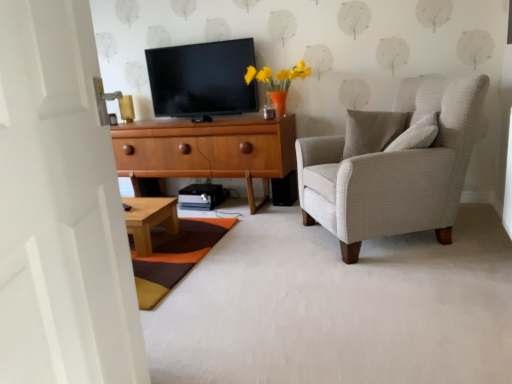
The height and width of the screenshot is (384, 512). What are the coordinates of `white wooden door at left` in the screenshot? It's located at (60, 209).

Where is `multicolored woven mat at lower center`? This screenshot has height=384, width=512. multicolored woven mat at lower center is located at coordinates (174, 256).

Identify the location of white carpet at center. The image size is (512, 384). (338, 306).

Is light gray fabric armchair at right with white carpet at center?

There is a gap between light gray fabric armchair at right and white carpet at center.

Looking at this image, which is less distant, (300, 143) or (440, 293)?

Point (440, 293)

From the image's perspective, relative to white carpet at center, is light gray fabric armchair at right above or below?

light gray fabric armchair at right is above white carpet at center.

Measure the distance from light gray fabric armchair at right to white carpet at center.

The distance of light gray fabric armchair at right from white carpet at center is 19.20 inches.

In the scene shown: Can you confirm if wooden cabinet at center is shorter than white carpet at center?

No.

Which is in front, wooden cabinet at center or white carpet at center?

white carpet at center is in front.

Is point (159, 146) closer or farther from the camera than point (421, 281)?

Point (159, 146) appears to be farther away from the viewer than point (421, 281).

From the image's perspective, which object appears higher, wooden cabinet at center or white carpet at center?

From the image's view, wooden cabinet at center is above.

Can you confirm if light gray fabric armchair at right is thinner than white wooden door at left?

In fact, light gray fabric armchair at right might be wider than white wooden door at left.

Based on the photo, from a real-world perspective, is light gray fabric armchair at right beneath white wooden door at left?

Yes, from a real-world perspective, light gray fabric armchair at right is below white wooden door at left.

Where is `door in front of the light gray fabric armchair at right`? The image size is (512, 384). door in front of the light gray fabric armchair at right is located at coordinates (60, 209).

From the image's perspective, would you say black glossy tv at upper center is positioned over multicolored woven mat at lower center?

Yes, from the image's perspective, black glossy tv at upper center is on top of multicolored woven mat at lower center.

Choose the correct answer: Is black glossy tv at upper center inside multicolored woven mat at lower center or outside it?

black glossy tv at upper center is located beyond the bounds of multicolored woven mat at lower center.

Which is more to the right, black glossy tv at upper center or multicolored woven mat at lower center?

Positioned to the right is black glossy tv at upper center.

Between point (179, 82) and point (197, 240), which one is positioned in front?

Point (197, 240)

Is wooden cabinet at center positioned with its back to light gray fabric armchair at right?

wooden cabinet at center does not have its back to light gray fabric armchair at right.

From a real-world perspective, is wooden cabinet at center under light gray fabric armchair at right?

Yes, from a real-world perspective, wooden cabinet at center is under light gray fabric armchair at right.

Is there a large distance between wooden cabinet at center and light gray fabric armchair at right?

No, there isn't a large distance between wooden cabinet at center and light gray fabric armchair at right.

Is wooden cabinet at center wider or thinner than light gray fabric armchair at right?

In the image, wooden cabinet at center appears to be more narrow than light gray fabric armchair at right.

From a real-world perspective, is black glossy tv at upper center located higher than light gray fabric armchair at right?

Indeed, from a real-world perspective, black glossy tv at upper center stands above light gray fabric armchair at right.

Is black glossy tv at upper center oriented towards light gray fabric armchair at right?

No, black glossy tv at upper center is not facing towards light gray fabric armchair at right.

Considering the relative sizes of black glossy tv at upper center and light gray fabric armchair at right in the image provided, is black glossy tv at upper center thinner than light gray fabric armchair at right?

Correct, the width of black glossy tv at upper center is less than that of light gray fabric armchair at right.

Locate an element on the screen. The height and width of the screenshot is (384, 512). television on the left side of light gray fabric armchair at right is located at coordinates (202, 79).

From the image's perspective, is white wooden door at left on multicolored woven mat at lower center?

Indeed, from the image's perspective, white wooden door at left is shown above multicolored woven mat at lower center.

Does white wooden door at left have a lesser width compared to multicolored woven mat at lower center?

Correct, the width of white wooden door at left is less than that of multicolored woven mat at lower center.

Which of these two, white wooden door at left or multicolored woven mat at lower center, stands taller?

white wooden door at left is taller.

Is multicolored woven mat at lower center located within white wooden door at left?

No.

Where is `plain on the left of light gray fabric armchair at right`? Image resolution: width=512 pixels, height=384 pixels. plain on the left of light gray fabric armchair at right is located at coordinates (338, 306).

Locate an element on the screen. plain that appears in front of the wooden cabinet at center is located at coordinates (338, 306).

When comparing their distances from white wooden door at left, does light gray fabric armchair at right or multicolored woven mat at lower center seem closer?

Among the two, multicolored woven mat at lower center is located nearer to white wooden door at left.

Looking at the image, which one is located closer to multicolored woven mat at lower center, light wood/texture coffee table at lower left or white wooden door at left?

Based on the image, light wood/texture coffee table at lower left appears to be nearer to multicolored woven mat at lower center.

From the image, which object appears to be nearer to wooden cabinet at center, white wooden door at left or multicolored woven mat at lower center?

Among the two, multicolored woven mat at lower center is located nearer to wooden cabinet at center.

Considering their positions, is light wood/texture coffee table at lower left positioned closer to white wooden door at left than multicolored woven mat at lower center?

Among the two, multicolored woven mat at lower center is located nearer to white wooden door at left.

Looking at the image, which one is located closer to multicolored woven mat at lower center, white carpet at center or light gray fabric armchair at right?

Based on the image, white carpet at center appears to be nearer to multicolored woven mat at lower center.

Which object lies nearer to the anchor point light wood/texture coffee table at lower left, white wooden door at left or black glossy tv at upper center?

The object closer to light wood/texture coffee table at lower left is black glossy tv at upper center.

Looking at this image, considering their positions, is wooden cabinet at center positioned closer to black glossy tv at upper center than light wood/texture coffee table at lower left?

wooden cabinet at center.

When comparing their distances from multicolored woven mat at lower center, does wooden cabinet at center or light wood/texture coffee table at lower left seem closer?

light wood/texture coffee table at lower left lies closer to multicolored woven mat at lower center than the other object.

Locate an element on the screen. plain between white wooden door at left and multicolored woven mat at lower center from front to back is located at coordinates (338, 306).

What are the coordinates of `mat positioned between white wooden door at left and light wood/texture coffee table at lower left from near to far` in the screenshot? It's located at (174, 256).

The width and height of the screenshot is (512, 384). What are the coordinates of `plain between white wooden door at left and light wood/texture coffee table at lower left from front to back` in the screenshot? It's located at (338, 306).

Where is `chair between white wooden door at left and black glossy tv at upper center from front to back`? The width and height of the screenshot is (512, 384). chair between white wooden door at left and black glossy tv at upper center from front to back is located at coordinates (393, 166).